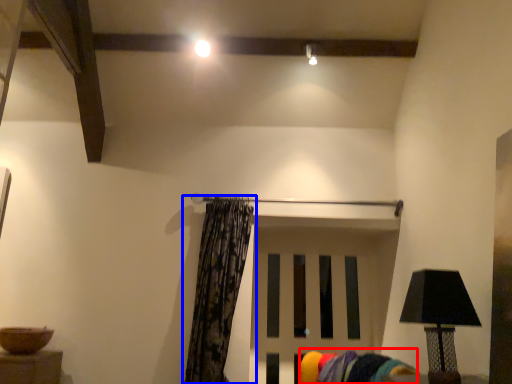
Question: Among these objects, which one is farthest to the camera, swivel chair (highlighted by a red box) or curtain (highlighted by a blue box)?

Choices:
 (A) swivel chair
 (B) curtain

Answer: (B)